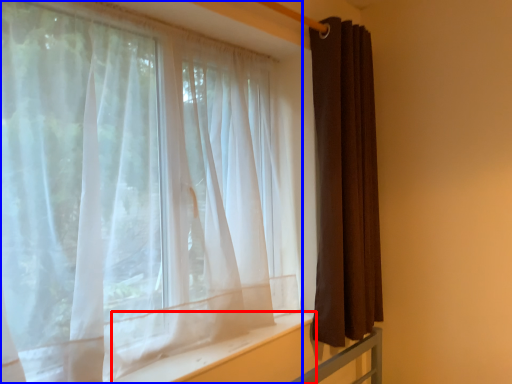
Question: Which point is closer to the camera, window sill (highlighted by a red box) or curtain (highlighted by a blue box)?

Choices:
 (A) window sill
 (B) curtain

Answer: (B)